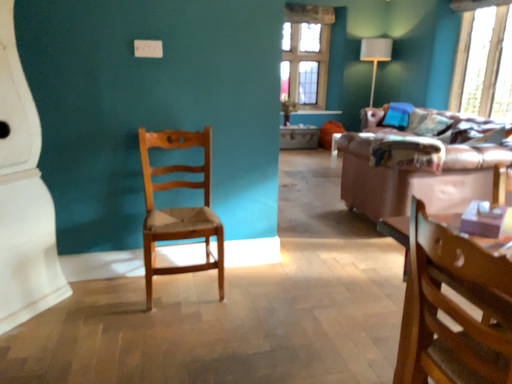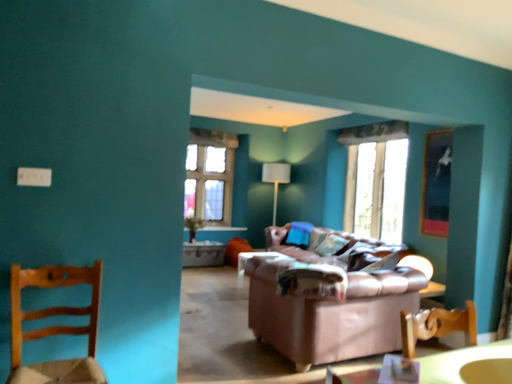
Question: Which way did the camera rotate in the video?

Choices:
 (A) rotated downward
 (B) rotated upward

Answer: (B)